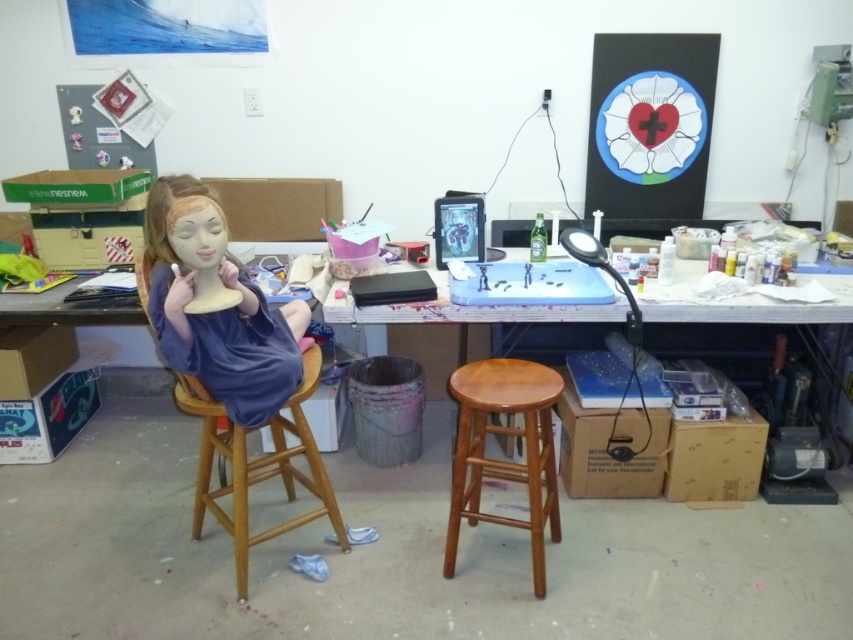
You are standing in the workspace and want to take a photo of the point at coordinates (543, 595). If your camera is positioned at your eye level, which is 5.5 feet above the ground, can you capture the point in your photo without moving the camera?

The point at coordinates (543, 595) is 6.89 feet away from the camera. Since the camera is at 5.5 feet height, the distance is sufficient to capture the point in the photo as long as there are no obstructions between them.

You are a photographer setting up a shot in the workspace. You have a camera and need to position yourself so that the light brown wood stool at center is in focus. The camera has a minimum focusing distance of 2 meters. Can you take a clear photo of the stool from your current position?

The light brown wood stool at center and camera are 1.93 meters apart, which is less than the camera minimum focusing distance of 2 meters. Therefore, you cannot take a clear photo of the stool from your current position.

You are an artist trying to decide where to place a new sculpture. The sculpture requires a base that can support its weight. Given the light brown wood stool at center and the wooden desk at center, which object is more suitable for placing the sculpture?

The wooden desk at center is more suitable for placing the sculpture because it is wider and can provide a sturdier base compared to the light brown wood stool at center, which is thinner and may not support heavy items as effectively.